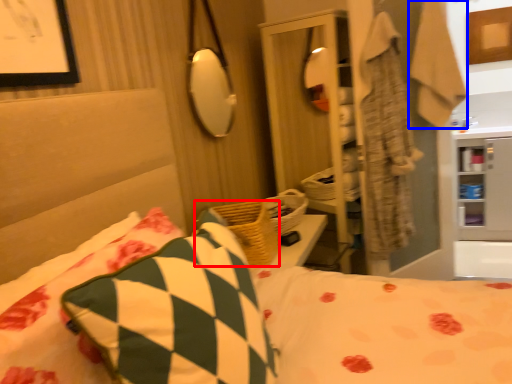
Question: Which of the following is the farthest to the observer, basket (highlighted by a red box) or robe (highlighted by a blue box)?

Choices:
 (A) basket
 (B) robe

Answer: (B)